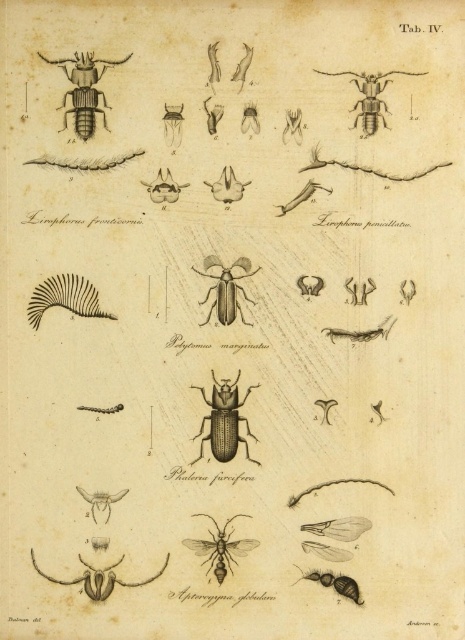
Question: Estimate the real-world distances between objects in this image. Which object is farther from the matte black beetle at upper right?

Choices:
 (A) brown matte insect at center
 (B) matte black beetle at lower left
 (C) matte black beetle at upper left
 (D) matte black antenna at lower left

Answer: (D)

Question: Can you confirm if matte black beetle at upper left is bigger than shiny black beetle at lower right?

Choices:
 (A) yes
 (B) no

Answer: (A)

Question: Considering the real-world distances, which object is closest to the black matte beetle at center?

Choices:
 (A) matte black antenna at lower left
 (B) brown matte insect at center

Answer: (B)

Question: Based on their relative distances, which object is nearer to the matte black beetle at lower left?

Choices:
 (A) brown matte beetle at center
 (B) matte black beetle at upper left

Answer: (A)

Question: Observing the image, what is the correct spatial positioning of brown matte insect at center in reference to shiny black beetle at lower right?

Choices:
 (A) right
 (B) left

Answer: (B)

Question: In this image, where is brown matte beetle at center located relative to matte black beetle at lower left?

Choices:
 (A) above
 (B) below

Answer: (A)